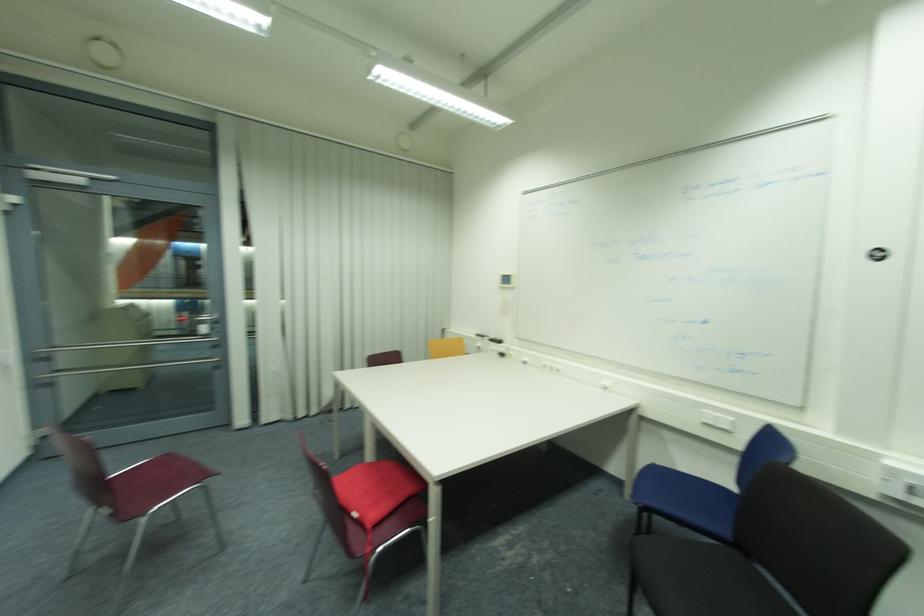
The width and height of the screenshot is (924, 616). In order to click on black chair sitting surface in this screenshot , I will do point(700,580).